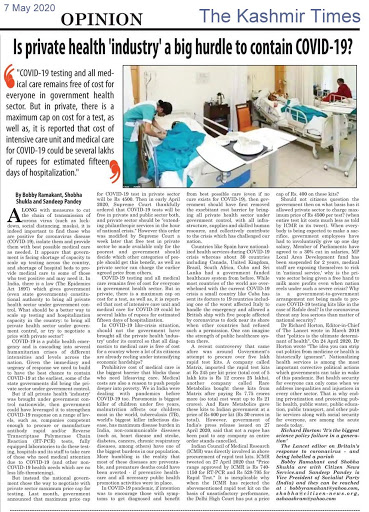
Identify the location of white tile floor. (336, 181), (298, 161), (287, 175).